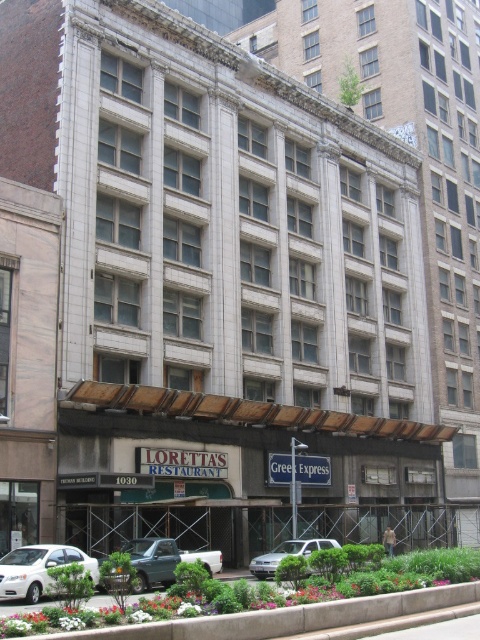
You are a pedestrian standing in front of the building. You see the green metallic truck at lower center and the silver metallic sedan at center. Which vehicle is nearer to you?

The green metallic truck at lower center is closer to the viewer than the silver metallic sedan at center.

You are a pedestrian standing at the entrance of Loretta Restaurant and want to cross the street to reach the bus stop. There is a white matte sedan at lower left and a green metallic truck at lower center blocking your path. Which vehicle should you move around first to get to the bus stop?

You should move around the white matte sedan at lower left first since it is positioned to the left of the green metallic truck at lower center, allowing you to navigate around it towards the bus stop.

You are a delivery person needing to park your 2.5 meter wide truck near Loretta Restaurant. The parking spot is between the green grass at lower center and the white matte sedan at lower left. Can your truck fit there?

The green grass at lower center is wider than the white matte sedan at lower left. However, since the parking spot is between them, the total width available would depend on their combined spacing. Without specific distance between them, it is uncertain if the 2.5 meter wide truck can fit.